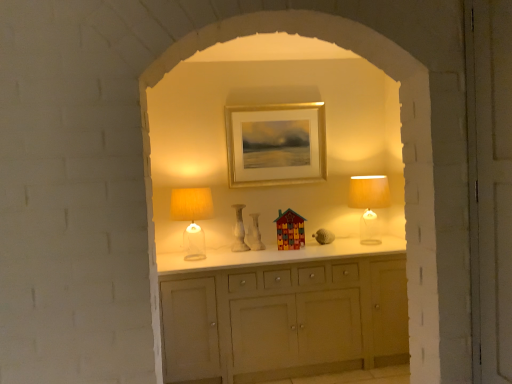
Question: From the image's perspective, is translucent glass table lamp at left, which is counted as the first table lamp, starting from the left, located above or below white marble vase at center, positioned as the first vase in left-to-right order?

Choices:
 (A) below
 (B) above

Answer: (B)

Question: Is translucent glass table lamp at left, which is counted as the first table lamp, starting from the left, wider or thinner than white marble vase at center, positioned as the first vase in left-to-right order?

Choices:
 (A) thin
 (B) wide

Answer: (B)

Question: Which object is positioned farthest from the white marble vase at center, the second vase from the right?

Choices:
 (A) gold metallic picture frame at center
 (B) white glossy vase at center, which is counted as the second vase, starting from the left
 (C) multicolored wooden house at center
 (D) translucent glass table lamp at left, the 2th table lamp viewed from the right
 (E) translucent glass table lamp at right, which is counted as the first table lamp, starting from the right

Answer: (E)

Question: Which object is the closest to the gold metallic picture frame at center?

Choices:
 (A) white marble vase at center, the second vase from the right
 (B) white glossy vase at center, which is counted as the second vase, starting from the left
 (C) translucent glass table lamp at left, which is counted as the first table lamp, starting from the left
 (D) translucent glass table lamp at right, which is counted as the first table lamp, starting from the right
 (E) multicolored wooden house at center

Answer: (A)